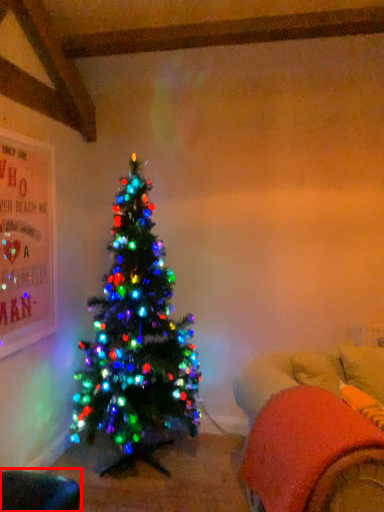
Question: From the image's perspective, what is the correct spatial positioning of bean bag chair (annotated by the red box) in reference to bean bag chair?

Choices:
 (A) below
 (B) above

Answer: (A)